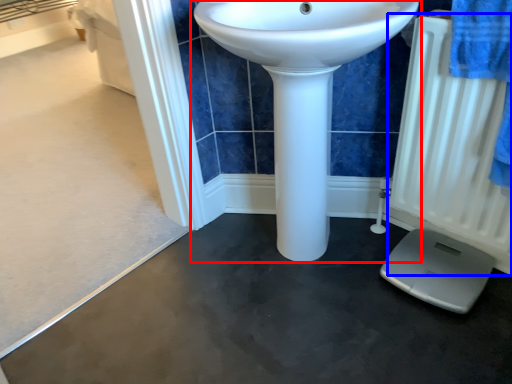
Question: Which object appears farthest to the camera in this image, sink (highlighted by a red box) or radiator (highlighted by a blue box)?

Choices:
 (A) sink
 (B) radiator

Answer: (B)